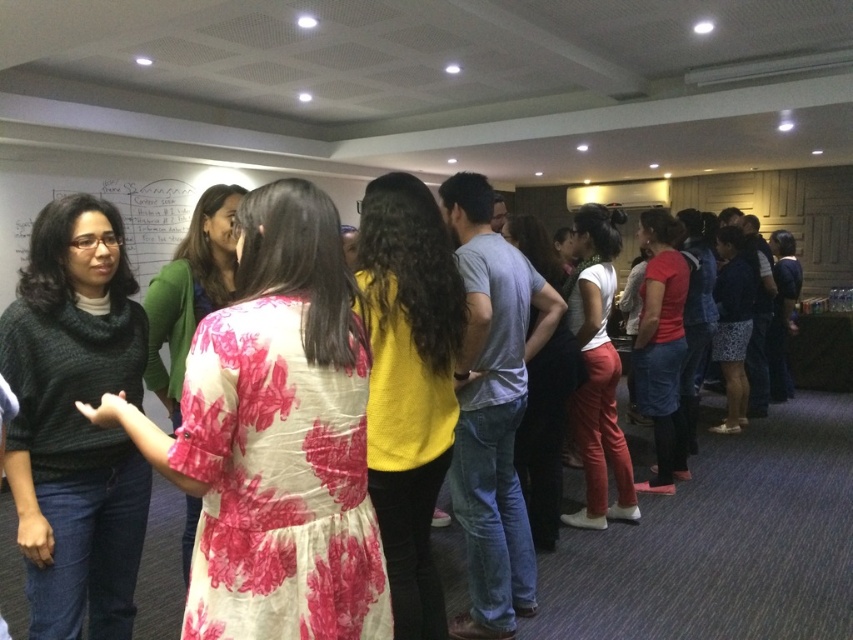
Can you confirm if white matte pants at center is positioned above matte red shirt at center?

Actually, white matte pants at center is below matte red shirt at center.

Based on the photo, can you confirm if white matte pants at center is positioned below matte red shirt at center?

Correct, white matte pants at center is located below matte red shirt at center.

Find the location of a particular element. This screenshot has height=640, width=853. white matte pants at center is located at coordinates (596, 371).

How much distance is there between white matte pants at center and floral fabric dress at center?

white matte pants at center is 1.85 meters away from floral fabric dress at center.

Can you confirm if white matte pants at center is smaller than floral fabric dress at center?

No, white matte pants at center is not smaller than floral fabric dress at center.

Between point (624, 448) and point (229, 273), which one is positioned in front?

Point (229, 273)

Image resolution: width=853 pixels, height=640 pixels. What are the coordinates of `white matte pants at center` in the screenshot? It's located at (596, 371).

Is yellow matte sweater at center thinner than matte yellow shirt at center?

Yes, yellow matte sweater at center is thinner than matte yellow shirt at center.

Between point (436, 451) and point (538, 234), which one is positioned in front?

Point (436, 451)

This screenshot has height=640, width=853. I want to click on yellow matte sweater at center, so click(409, 384).